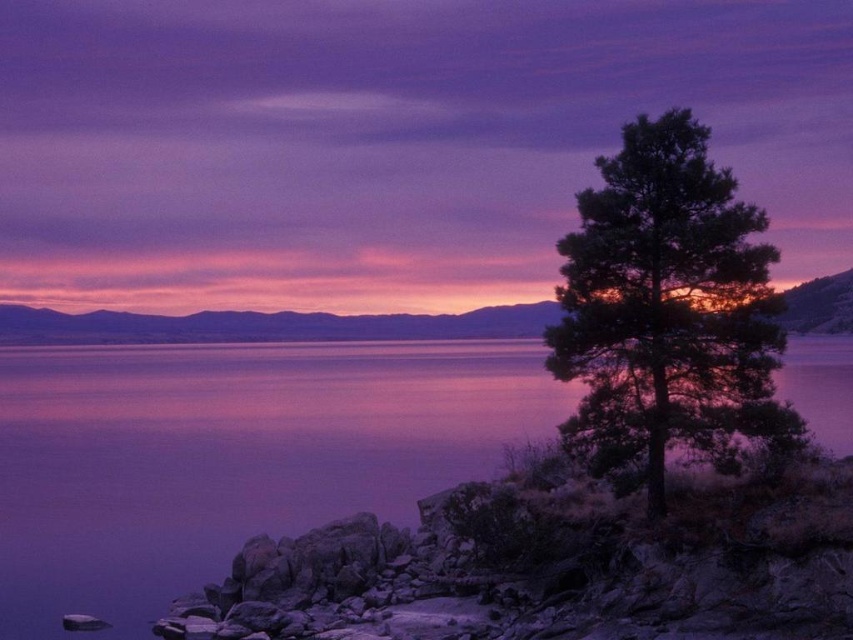
You are a photographer trying to capture the reflection of the dark green textured tree at right in the purple smooth water at center. Based on the scene, will the tree be fully reflected in the water?

The purple smooth water at center is not as tall as dark green textured tree at right, so the tree will not be fully reflected in the water since the water is lower than the tree.

You are a photographer planning to capture the serene lakeside scene. You want to ensure that both the purple smooth water at center and the dark green textured tree at right are visible in your shot. Given their widths, which object will occupy more of the horizontal space in your photo?

The purple smooth water at center will occupy more horizontal space in your photo since its width surpasses that of the dark green textured tree at right.